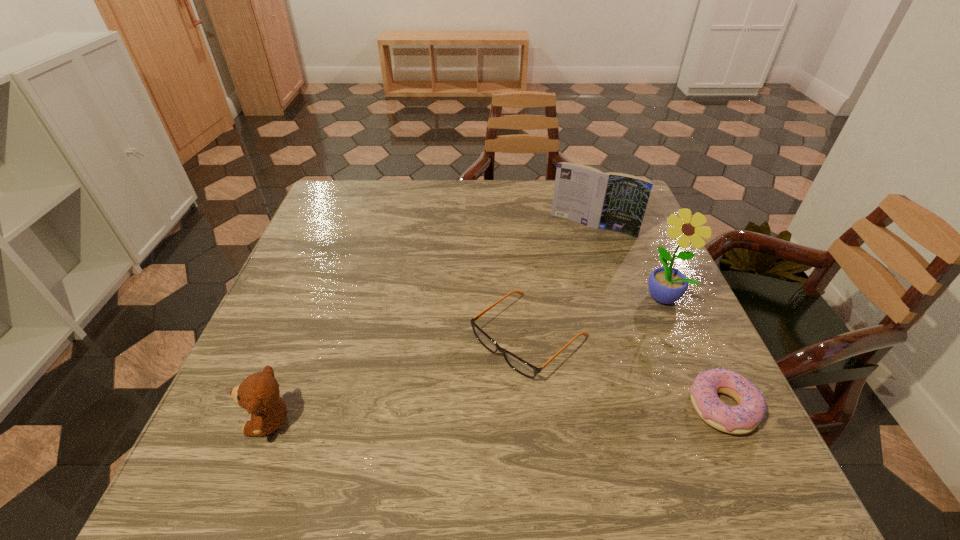
In order to click on vacant space located on the front-facing side of the sunflower in this screenshot , I will do `click(561, 411)`.

Identify the location of blank space located 0.370m on the front-facing side of the sunflower. This screenshot has width=960, height=540. (557, 415).

The height and width of the screenshot is (540, 960). In order to click on vacant space located on the front cover of the fourth shortest object in this screenshot , I will do `click(558, 275)`.

Find the location of a particular element. The height and width of the screenshot is (540, 960). vacant point located 0.370m on the front cover of the fourth shortest object is located at coordinates (528, 330).

At what (x,y) coordinates should I click in order to perform the action: click on free location located 0.080m on the front cover of the fourth shortest object. Please return your answer as a coordinate pair (x, y). The width and height of the screenshot is (960, 540). Looking at the image, I should click on (569, 254).

Locate an element on the screen. This screenshot has height=540, width=960. free region located on the front-facing side of the spectacles is located at coordinates (432, 420).

You are a GUI agent. You are given a task and a screenshot of the screen. Output one action in this format:
    pyautogui.click(x=<x>, y=<y>)
    Task: Click on the free spot located on the front-facing side of the spectacles
    This screenshot has height=540, width=960.
    Given the screenshot: What is the action you would take?
    pos(427,423)

This screenshot has height=540, width=960. Identify the location of free space located 0.190m on the front-facing side of the spectacles. (415, 435).

What are the coordinates of `object located at the far edge` in the screenshot? It's located at (613, 201).

In order to click on teddy bear located in the near edge section of the desktop in this screenshot , I will do `click(259, 393)`.